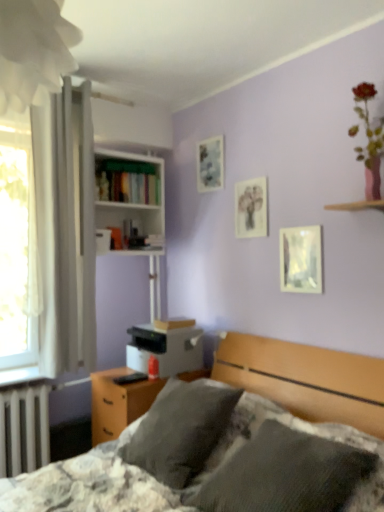
This screenshot has height=512, width=384. What do you see at coordinates (181, 430) in the screenshot?
I see `gray soft pillow at center, positioned as the second pillow in front-to-back order` at bounding box center [181, 430].

This screenshot has width=384, height=512. In order to click on matte glass picture frame at upper center, arranged as the 1th picture frame when viewed from the left in this screenshot , I will do `click(210, 164)`.

This screenshot has width=384, height=512. I want to click on matte paper picture frame at center, the 2th picture frame from the back, so click(x=251, y=208).

The image size is (384, 512). I want to click on fluffy gray pillow at center, arranged as the 2th pillow when viewed from the back, so click(293, 475).

This screenshot has height=512, width=384. Find the location of `textured gray pillows at center`. textured gray pillows at center is located at coordinates (245, 442).

From a real-world perspective, relative to metallic reflective picture frame at upper right, which ranks as the 1th picture frame in right-to-left order, is white metallic radiator at lower left vertically above or below?

In terms of real-world spatial position, white metallic radiator at lower left is below metallic reflective picture frame at upper right, which ranks as the 1th picture frame in right-to-left order.

Is white metallic radiator at lower left looking in the opposite direction of metallic reflective picture frame at upper right, arranged as the 3th picture frame when viewed from the left?

No, metallic reflective picture frame at upper right, arranged as the 3th picture frame when viewed from the left, is not at the back of white metallic radiator at lower left.

Would you say white metallic radiator at lower left is outside metallic reflective picture frame at upper right, positioned as the third picture frame in top-to-bottom order?

That's correct, white metallic radiator at lower left is outside of metallic reflective picture frame at upper right, positioned as the third picture frame in top-to-bottom order.

Is white metallic radiator at lower left touching metallic reflective picture frame at upper right, arranged as the 3th picture frame when viewed from the left?

white metallic radiator at lower left and metallic reflective picture frame at upper right, arranged as the 3th picture frame when viewed from the left, are clearly separated.

Is point (119, 166) closer or farther from the camera than point (175, 455)?

Point (119, 166) appears to be farther away from the viewer than point (175, 455).

Is hardcover books at center-left far away from gray soft pillow at center, positioned as the second pillow in front-to-back order?

Yes, hardcover books at center-left is far from gray soft pillow at center, positioned as the second pillow in front-to-back order.

How many degrees apart are the facing directions of hardcover books at center-left and gray soft pillow at center, which is the first pillow in back-to-front order?

The angular difference between hardcover books at center-left and gray soft pillow at center, which is the first pillow in back-to-front order, is 90 degrees.

Based on their sizes in the image, would you say hardcover books at center-left is bigger or smaller than gray soft pillow at center, positioned as the second pillow in front-to-back order?

In the image, hardcover books at center-left appears to be smaller than gray soft pillow at center, positioned as the second pillow in front-to-back order.

Considering the sizes of metallic reflective picture frame at upper right, positioned as the third picture frame in top-to-bottom order, and gray soft pillow at center, positioned as the second pillow in front-to-back order, in the image, is metallic reflective picture frame at upper right, positioned as the third picture frame in top-to-bottom order, bigger or smaller than gray soft pillow at center, positioned as the second pillow in front-to-back order,?

metallic reflective picture frame at upper right, positioned as the third picture frame in top-to-bottom order, is smaller than gray soft pillow at center, positioned as the second pillow in front-to-back order.

Is metallic reflective picture frame at upper right, which ranks as the 1th picture frame in right-to-left order, next to gray soft pillow at center, which is the first pillow in back-to-front order, and touching it?

There is a gap between metallic reflective picture frame at upper right, which ranks as the 1th picture frame in right-to-left order, and gray soft pillow at center, which is the first pillow in back-to-front order.

Is metallic reflective picture frame at upper right, arranged as the 3th picture frame when viewed from the left, closer to the viewer compared to gray soft pillow at center, positioned as the second pillow in front-to-back order?

No, metallic reflective picture frame at upper right, arranged as the 3th picture frame when viewed from the left, is behind gray soft pillow at center, positioned as the second pillow in front-to-back order.

Is white fabric at upper left bigger or smaller than white metallic radiator at lower left?

Clearly, white fabric at upper left is larger in size than white metallic radiator at lower left.

From the image's perspective, which is above, white fabric at upper left or white metallic radiator at lower left?

white fabric at upper left.

Is white fabric at upper left in contact with white metallic radiator at lower left?

No, white fabric at upper left is not with white metallic radiator at lower left.

Considering the relative positions of metallic reflective picture frame at upper right, the 1th picture frame in the front-to-back sequence, and hardcover books at center-left in the image provided, is metallic reflective picture frame at upper right, the 1th picture frame in the front-to-back sequence, to the left or to the right of hardcover books at center-left?

Based on their positions, metallic reflective picture frame at upper right, the 1th picture frame in the front-to-back sequence, is located to the right of hardcover books at center-left.

Consider the image. From the image's perspective, is metallic reflective picture frame at upper right, positioned as the third picture frame in top-to-bottom order, beneath hardcover books at center-left?

Yes, from the image's perspective, metallic reflective picture frame at upper right, positioned as the third picture frame in top-to-bottom order, is below hardcover books at center-left.

Is metallic reflective picture frame at upper right, arranged as the 3th picture frame when viewed from the left, positioned with its back to hardcover books at center-left?

That's not correct — metallic reflective picture frame at upper right, arranged as the 3th picture frame when viewed from the left, is not looking away from hardcover books at center-left.

At what (x,y) coordinates should I click in order to perform the action: click on the 1st pillow directly above the white metallic radiator at lower left (from a real-world perspective). Please return your answer as a coordinate pair (x, y). Image resolution: width=384 pixels, height=512 pixels. Looking at the image, I should click on (293, 475).

Is white metallic radiator at lower left oriented away from fluffy gray pillow at center, arranged as the 2th pillow when viewed from the back?

white metallic radiator at lower left does not have its back to fluffy gray pillow at center, arranged as the 2th pillow when viewed from the back.

Measure the distance between white metallic radiator at lower left and fluffy gray pillow at center, which is counted as the first pillow, starting from the front.

white metallic radiator at lower left and fluffy gray pillow at center, which is counted as the first pillow, starting from the front, are 1.47 meters apart from each other.

From the picture: Considering the sizes of white metallic radiator at lower left and fluffy gray pillow at center, arranged as the 2th pillow when viewed from the back, in the image, is white metallic radiator at lower left wider or thinner than fluffy gray pillow at center, arranged as the 2th pillow when viewed from the back,?

Clearly, white metallic radiator at lower left has less width compared to fluffy gray pillow at center, arranged as the 2th pillow when viewed from the back.

Is matte paper picture frame at center, which is the 2th picture frame in front-to-back order, touching hardcover books at center-left?

matte paper picture frame at center, which is the 2th picture frame in front-to-back order, and hardcover books at center-left are clearly separated.

Considering the sizes of matte paper picture frame at center, acting as the second picture frame starting from the top, and hardcover books at center-left in the image, is matte paper picture frame at center, acting as the second picture frame starting from the top, wider or thinner than hardcover books at center-left?

Considering their sizes, matte paper picture frame at center, acting as the second picture frame starting from the top, looks slimmer than hardcover books at center-left.

Identify the location of picture frame that is the 1st object directly below the hardcover books at center-left (from a real-world perspective). The image size is (384, 512). tap(251, 208).

Between matte paper picture frame at center, acting as the second picture frame starting from the top, and hardcover books at center-left, which one has smaller size?

With smaller size is matte paper picture frame at center, acting as the second picture frame starting from the top.

Find the location of a particular element. The image size is (384, 512). radiator below the metallic reflective picture frame at upper right, the first picture frame positioned from the bottom (from a real-world perspective) is located at coordinates (24, 429).

From the hardcover books at center-left, count 1st pillows forward and point to it. Please provide its 2D coordinates.

[(181, 430)]

Based on their spatial positions, is white glossy bookcase at upper center or gray soft pillow at center, positioned as the second pillow in front-to-back order, further from fluffy gray pillow at center, arranged as the 2th pillow when viewed from the back?

white glossy bookcase at upper center lies further to fluffy gray pillow at center, arranged as the 2th pillow when viewed from the back, than the other object.

Which object lies further to the anchor point white fabric curtain at left, fluffy gray pillow at center, which is counted as the first pillow, starting from the front, or textured gray pillows at center?

fluffy gray pillow at center, which is counted as the first pillow, starting from the front, lies further to white fabric curtain at left than the other object.

Looking at the image, which one is located further to white metallic radiator at lower left, matte paper picture frame at center, which is the 2th picture frame in front-to-back order, or textured gray pillows at center?

Based on the image, matte paper picture frame at center, which is the 2th picture frame in front-to-back order, appears to be further to white metallic radiator at lower left.

Estimate the real-world distances between objects in this image. Which object is further from hardcover books at center-left, metallic reflective picture frame at upper right, the third picture frame when ordered from back to front, or fluffy gray pillow at center, which is counted as the first pillow, starting from the front?

Based on the image, fluffy gray pillow at center, which is counted as the first pillow, starting from the front, appears to be further to hardcover books at center-left.

When comparing their distances from hardcover books at center-left, does matte paper picture frame at center, placed as the second picture frame when sorted from left to right, or white fabric at upper left seem closer?

matte paper picture frame at center, placed as the second picture frame when sorted from left to right, is closer to hardcover books at center-left.

When comparing their distances from white fabric at upper left, does white glossy bookcase at upper center or hardcover books at center-left seem further?

white glossy bookcase at upper center is further to white fabric at upper left.

Estimate the real-world distances between objects in this image. Which object is closer to white fabric at upper left, textured gray pillows at center or matte paper picture frame at center, which is counted as the second picture frame, starting from the right?

matte paper picture frame at center, which is counted as the second picture frame, starting from the right, is closer to white fabric at upper left.

Considering their positions, is white fabric at upper left positioned closer to gray soft pillow at center, which is the first pillow in back-to-front order, than metallic reflective picture frame at upper right, arranged as the 3th picture frame when viewed from the left?

Among the two, metallic reflective picture frame at upper right, arranged as the 3th picture frame when viewed from the left, is located nearer to gray soft pillow at center, which is the first pillow in back-to-front order.

In order to click on picture frame between fluffy gray pillow at center, arranged as the 2th pillow when viewed from the back, and matte paper picture frame at center, acting as the second picture frame starting from the top, along the z-axis in this screenshot , I will do `click(301, 259)`.

You are a GUI agent. You are given a task and a screenshot of the screen. Output one action in this format:
    pyautogui.click(x=<x>, y=<y>)
    Task: Click on the curtain between white glossy bookcase at upper center and white metallic radiator at lower left in the vertical direction
    
    Given the screenshot: What is the action you would take?
    pyautogui.click(x=66, y=229)

This screenshot has height=512, width=384. I want to click on curtain that lies between hardcover books at center-left and white metallic radiator at lower left from top to bottom, so click(x=66, y=229).

Locate an element on the screen. picture frame between textured gray pillows at center and white fabric curtain at left along the z-axis is located at coordinates (301, 259).